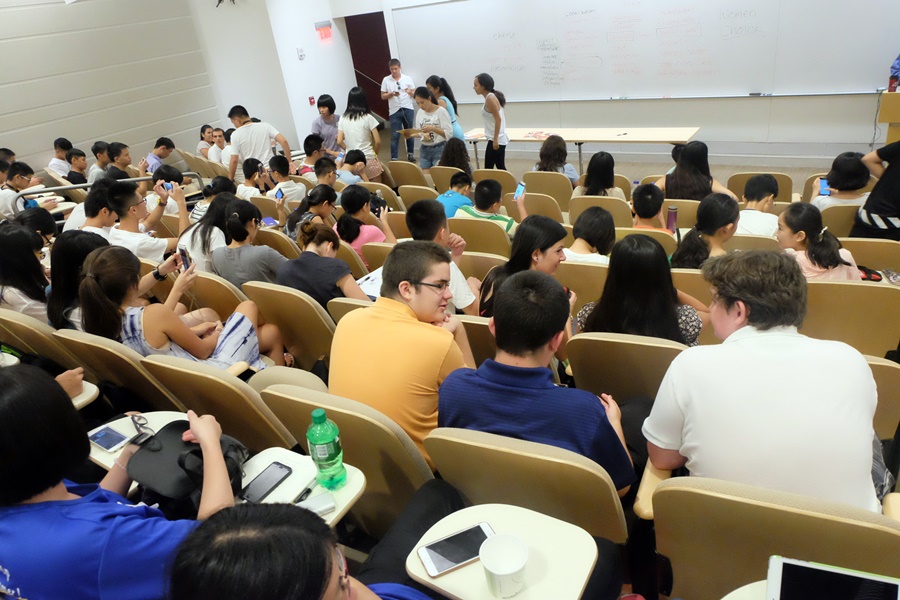
Provide coordinates for each what holds the instructor table up instance in the image. Your answer should be formatted as a list of tuples, i.e. [(x1, y1), (x2, y2), ...], where each tuple contains the x and y coordinates of a point satisfying the conditions above.

[(579, 160), (475, 150)]